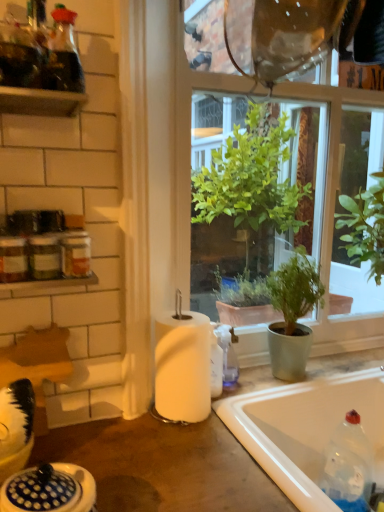
Question: Is white matte paper towel at center thinner than transparent glass window at center?

Choices:
 (A) no
 (B) yes

Answer: (B)

Question: Does white matte paper towel at center appear on the left side of transparent glass window at center?

Choices:
 (A) yes
 (B) no

Answer: (A)

Question: Can you confirm if white matte paper towel at center is taller than transparent glass window at center?

Choices:
 (A) yes
 (B) no

Answer: (B)

Question: Considering the relative sizes of white matte paper towel at center and transparent glass window at center in the image provided, is white matte paper towel at center smaller than transparent glass window at center?

Choices:
 (A) yes
 (B) no

Answer: (A)

Question: Is white matte paper towel at center at the right side of transparent glass window at center?

Choices:
 (A) yes
 (B) no

Answer: (B)

Question: Considering the positions of point (33, 104) and point (89, 274), is point (33, 104) closer or farther from the camera than point (89, 274)?

Choices:
 (A) farther
 (B) closer

Answer: (A)

Question: Based on their sizes in the image, would you say wooden shelf at upper left is bigger or smaller than white glossy shelf at upper left?

Choices:
 (A) big
 (B) small

Answer: (B)

Question: From a real-world perspective, is wooden shelf at upper left positioned above or below white glossy shelf at upper left?

Choices:
 (A) below
 (B) above

Answer: (B)

Question: In the image, is wooden shelf at upper left positioned in front of or behind white glossy shelf at upper left?

Choices:
 (A) front
 (B) behind

Answer: (A)

Question: Based on their positions, is white matte paper towel at center located to the left or right of white glossy bathtub at lower right?

Choices:
 (A) right
 (B) left

Answer: (B)

Question: In terms of size, does white matte paper towel at center appear bigger or smaller than white glossy bathtub at lower right?

Choices:
 (A) small
 (B) big

Answer: (A)

Question: From the image's perspective, relative to white glossy bathtub at lower right, is white matte paper towel at center above or below?

Choices:
 (A) above
 (B) below

Answer: (A)

Question: Is white matte paper towel at center taller or shorter than white glossy bathtub at lower right?

Choices:
 (A) short
 (B) tall

Answer: (B)

Question: Looking at the image, does wooden shelf at upper left seem bigger or smaller compared to white glossy sink at lower left?

Choices:
 (A) big
 (B) small

Answer: (B)

Question: Would you say wooden shelf at upper left is to the left or to the right of white glossy sink at lower left in the picture?

Choices:
 (A) right
 (B) left

Answer: (B)